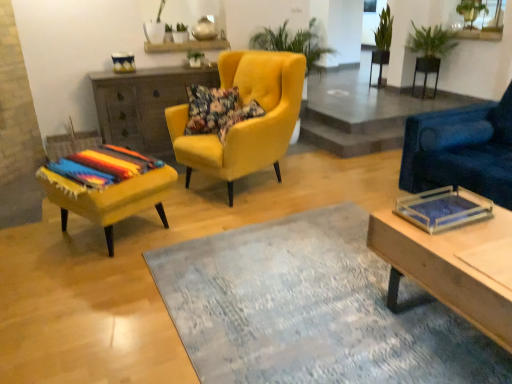
Where is `vacant space situated above matte yellow ottoman at left, which ranks as the first chair in left-to-right order (from a real-world perspective)`? The height and width of the screenshot is (384, 512). vacant space situated above matte yellow ottoman at left, which ranks as the first chair in left-to-right order (from a real-world perspective) is located at coordinates (100, 169).